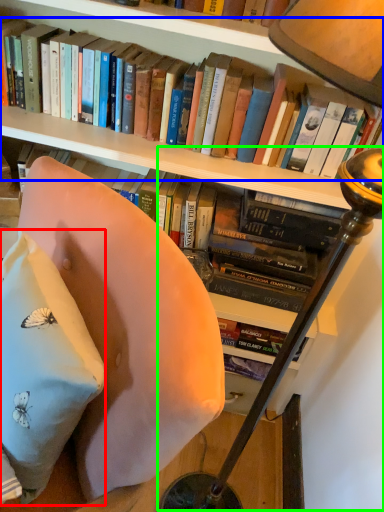
Question: Estimate the real-world distances between objects in this image. Which object is closer to pillow (highlighted by a red box), book (highlighted by a blue box) or table lamp (highlighted by a green box)?

Choices:
 (A) book
 (B) table lamp

Answer: (B)